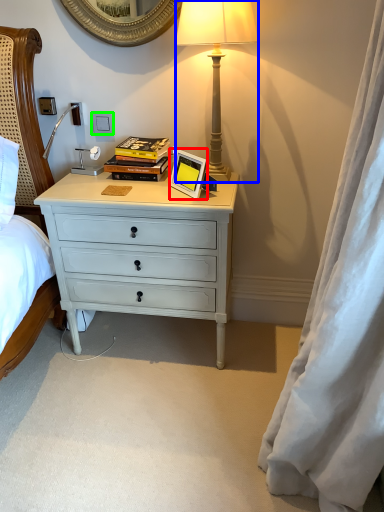
Question: Considering the real-world distances, which object is closest to picture frame (highlighted by a red box)? lamp (highlighted by a blue box) or power outlet (highlighted by a green box).

Choices:
 (A) lamp
 (B) power outlet

Answer: (A)